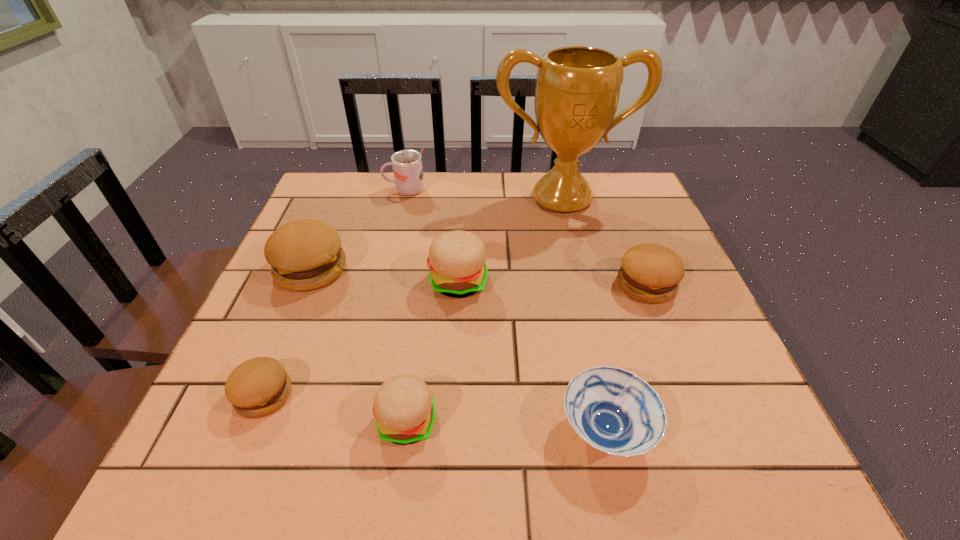
You are a GUI agent. You are given a task and a screenshot of the screen. Output one action in this format:
    pyautogui.click(x=<x>, y=<y>)
    Task: Click on the vacant area situated 0.380m on the front of the tallest object with the decoration
    
    Given the screenshot: What is the action you would take?
    pyautogui.click(x=594, y=330)

Image resolution: width=960 pixels, height=540 pixels. Identify the location of vacant space located on the side with the handle of the cup. (341, 191).

Identify the location of free point located on the side with the handle of the cup. This screenshot has width=960, height=540. (334, 191).

Where is `vacant space located on the side with the handle of the cup`? Image resolution: width=960 pixels, height=540 pixels. vacant space located on the side with the handle of the cup is located at coordinates (317, 191).

You are a GUI agent. You are given a task and a screenshot of the screen. Output one action in this format:
    pyautogui.click(x=<x>, y=<y>)
    Task: Click on the free location located on the back of the bigger beige hamburger
    Image resolution: width=960 pixels, height=540 pixels.
    Given the screenshot: What is the action you would take?
    pos(462,212)

The width and height of the screenshot is (960, 540). What are the coordinates of `vacant space situated on the front of the biggest brown hamburger` in the screenshot? It's located at (232, 458).

Identify the location of free spot located on the front of the rightmost hamburger. (668, 340).

Locate an element on the screen. This screenshot has width=960, height=540. vacant space situated on the back of the nearer beige hamburger is located at coordinates (415, 359).

Locate an element on the screen. vacant space located on the right of the blue soup bowl is located at coordinates (696, 430).

You are a GUI agent. You are given a task and a screenshot of the screen. Output one action in this format:
    pyautogui.click(x=<x>, y=<y>)
    Task: Click on the vacant space situated on the back of the nearest brown hamburger
    Image resolution: width=960 pixels, height=540 pixels.
    Given the screenshot: What is the action you would take?
    pyautogui.click(x=300, y=304)